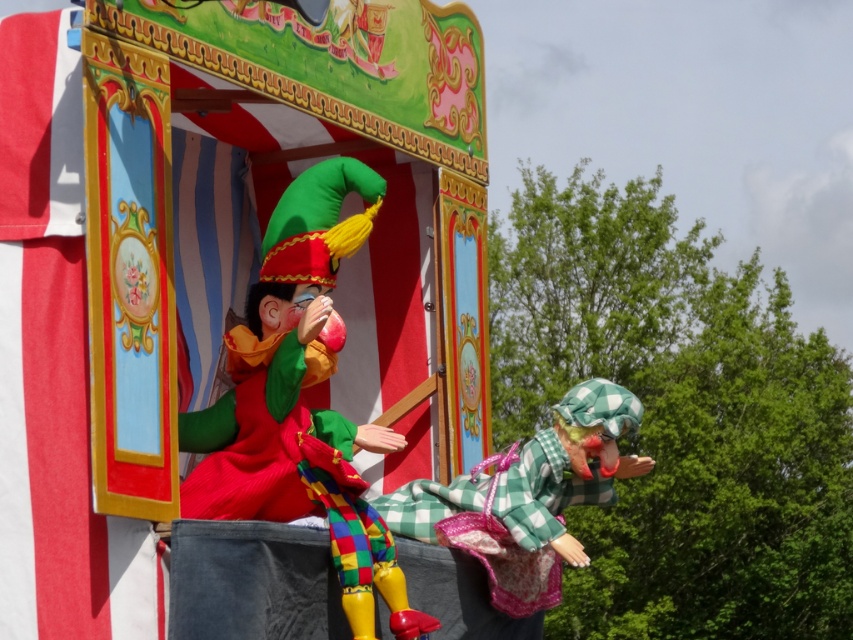
You are a spectator standing in front of the red and white striped curtain at the left side of the image. You see the matte plastic clown at center and the green checkered dress at center. Which object is closer to you?

The matte plastic clown at center is closer to you because it is in front of the green checkered dress at center.

What is the material of the object located at point (300, 401)?

The object at point (300, 401) is made of matte plastic.

In the scene shown: You are a spectator at the carnival and spot the matte plastic clown at center and the green checkered dress at center. Which one is positioned more to the left side?

The matte plastic clown at center is positioned more to the left side than the green checkered dress at center.